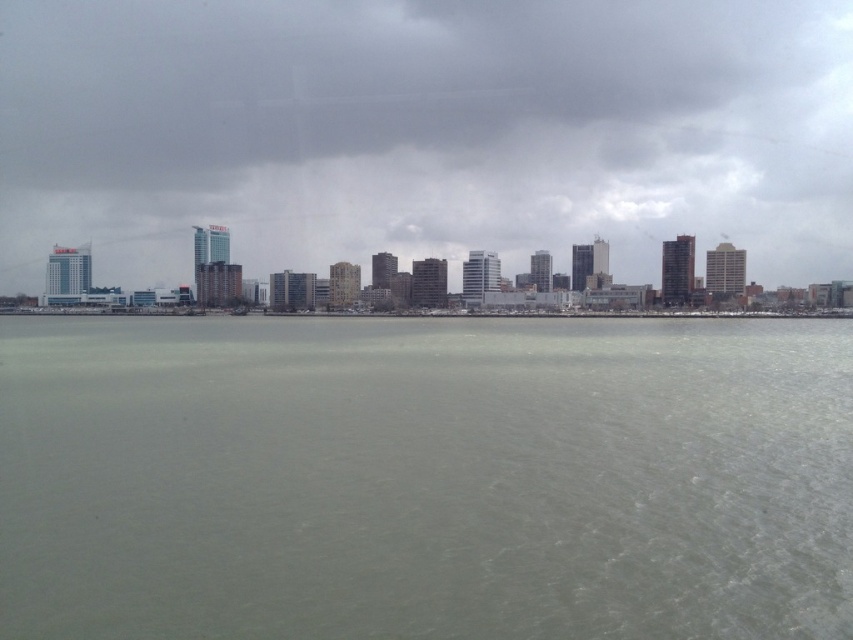
You are a photographer planning to capture the city skyline from a boat. You notice the gray matte water at center and the gray cloudy sky at upper center. Which of these two elements is located below the other in the image?

The gray matte water at center is positioned under the gray cloudy sky at upper center, meaning the water is below the sky in the image.

You are an architect evaluating the cityscape from a boat. You notice the gray matte water at center and the gray cloudy sky at upper center. Which of these two elements occupies a larger vertical space in the scene?

The gray cloudy sky at upper center occupies a larger vertical space than the gray matte water at center because the water is described as not as tall as the sky.

You are a drone operator planning to fly a drone from the gray cloudy sky at upper center to the gray matte water at center. According to the scene description, what is the minimum vertical distance the drone must descend to reach the water?

The gray matte water at center is 461.99 feet from the gray cloudy sky at upper center, so the drone must descend at least 461.99 feet to reach the water.